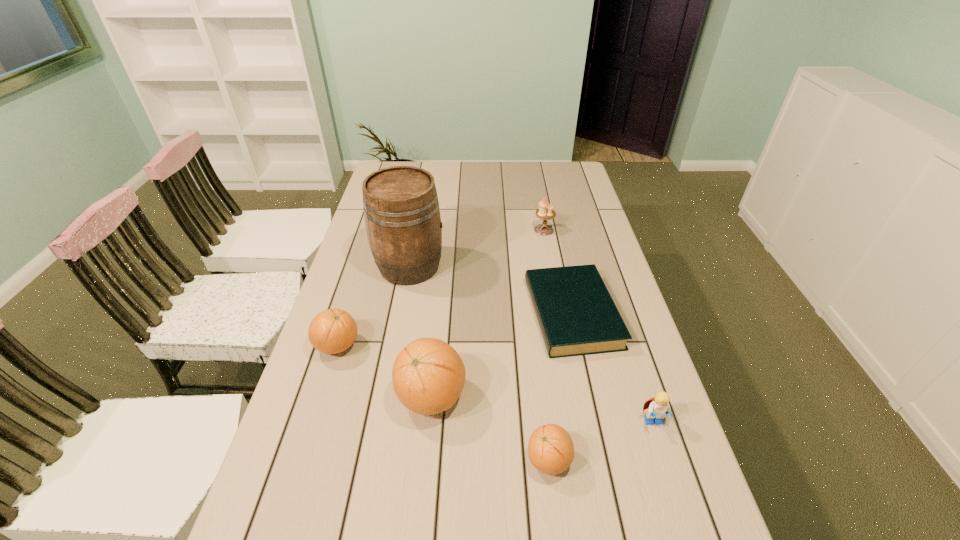
This screenshot has width=960, height=540. In order to click on vacant area between the tallest orange and the book in this screenshot , I will do (502, 355).

This screenshot has width=960, height=540. What are the coordinates of `blank region between the shortest object and the second orange from left to right` in the screenshot? It's located at (502, 355).

This screenshot has width=960, height=540. I want to click on object that ranks as the fifth closest to the nearest orange, so click(401, 210).

Where is `object that is the sixth closest to the second shortest orange`? object that is the sixth closest to the second shortest orange is located at coordinates (659, 406).

Identify which orange is the third closest to the book. Please provide its 2D coordinates. Your answer should be formatted as a tuple, i.e. [(x, y)], where the tuple contains the x and y coordinates of a point satisfying the conditions above.

[(332, 331)]

Locate which orange ranks in proximity to the nearest object. Please provide its 2D coordinates. Your answer should be formatted as a tuple, i.e. [(x, y)], where the tuple contains the x and y coordinates of a point satisfying the conditions above.

[(428, 375)]

Find the location of a particular element. The image size is (960, 540). free space in the image that satisfies the following two spatial constraints: 1. on the back side of the second farthest orange; 2. on the side of the tallest object near the bung hole is located at coordinates (444, 266).

At what (x,y) coordinates should I click in order to perform the action: click on free location that satisfies the following two spatial constraints: 1. on the back side of the second shortest orange; 2. on the right side of the farthest object. Please return your answer as a coordinate pair (x, y). Image resolution: width=960 pixels, height=540 pixels. Looking at the image, I should click on (374, 230).

The width and height of the screenshot is (960, 540). Identify the location of free space that satisfies the following two spatial constraints: 1. on the back side of the nearest object; 2. on the side of the cider near the bung hole. (525, 266).

The height and width of the screenshot is (540, 960). I want to click on free space that satisfies the following two spatial constraints: 1. on the back side of the candle holder; 2. on the right side of the second nearest orange, so click(x=447, y=230).